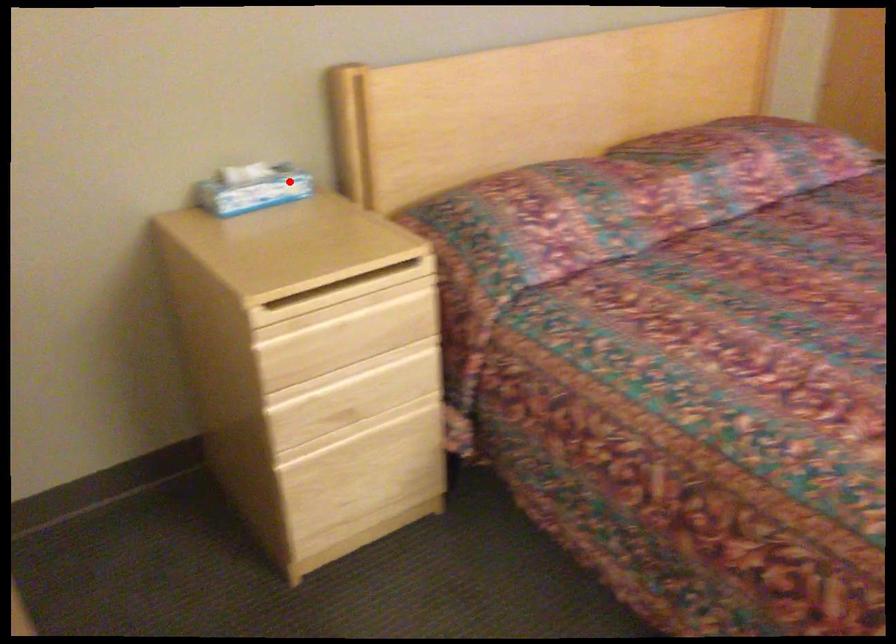
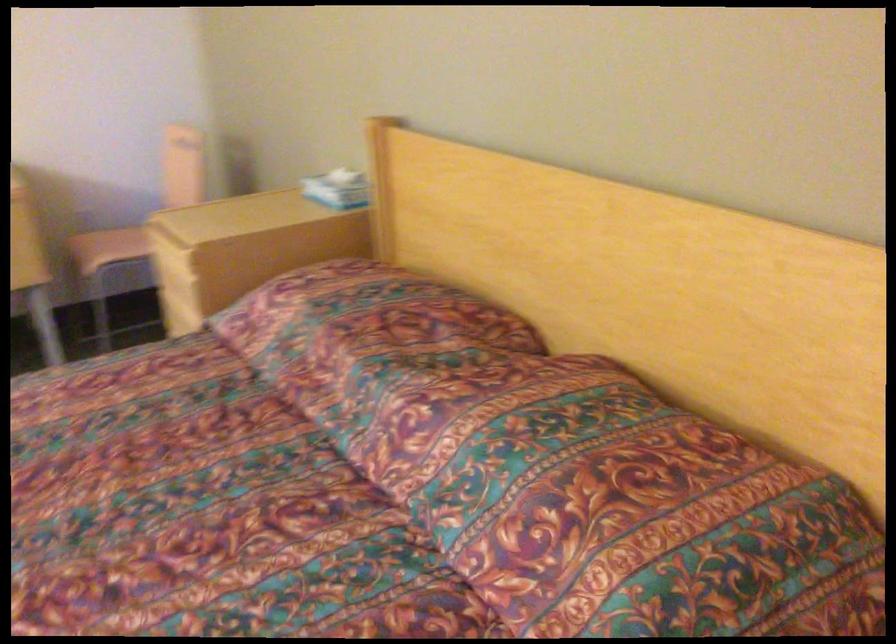
Question: I am providing you with two images of the same scene from different viewpoints. Given a red point in image1, look at the same physical point in image2. Is it:

Choices:
 (A) Closer to the viewpoint
 (B) Farther from the viewpoint

Answer: (B)